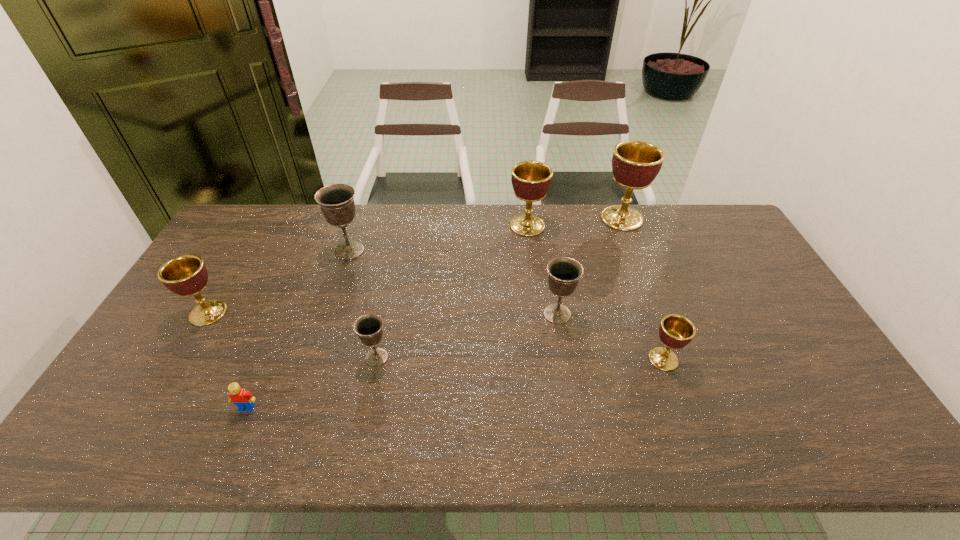
Locate an element on the screen. This screenshot has height=540, width=960. the nearest bronze chalice is located at coordinates (368, 327).

Identify the location of the nearest golden chalice. (675, 332).

At what (x,y) coordinates should I click in order to perform the action: click on the seventh object from right to left. Please return your answer as a coordinate pair (x, y). This screenshot has width=960, height=540. Looking at the image, I should click on (244, 400).

Identify the location of the nearest object. (244, 400).

This screenshot has height=540, width=960. In order to click on vacant space located 0.330m on the left of the tallest object in this screenshot , I will do `click(510, 218)`.

Locate an element on the screen. The width and height of the screenshot is (960, 540). free space located on the right of the third golden chalice from right to left is located at coordinates (602, 226).

Identify the location of vacant space located 0.230m on the front of the leftmost bronze chalice. (328, 315).

The image size is (960, 540). Identify the location of vacant area situated 0.100m on the front of the leftmost object. (182, 356).

The image size is (960, 540). What are the coordinates of `vacant space situated on the right of the rightmost bronze chalice` in the screenshot? It's located at (660, 314).

Locate an element on the screen. vacant space located 0.260m on the left of the second bronze chalice from right to left is located at coordinates (266, 357).